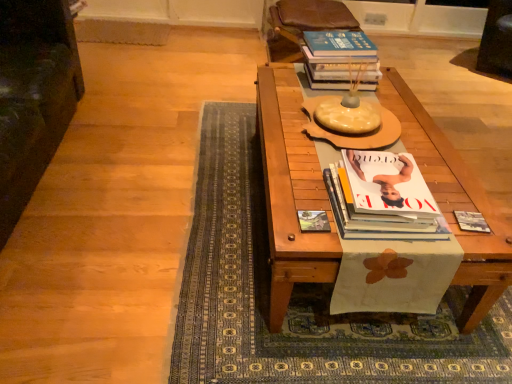
Find the location of a particular element. vacant space that is to the left of matte paper book cover at center is located at coordinates (283, 221).